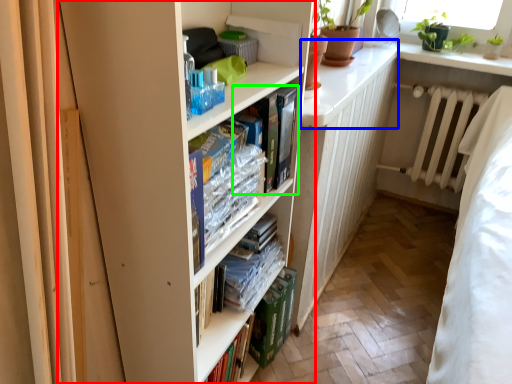
Question: Considering the real-world distances, which object is closest to bookcase (highlighted by a red box)? counter top (highlighted by a blue box) or book (highlighted by a green box).

Choices:
 (A) counter top
 (B) book

Answer: (B)